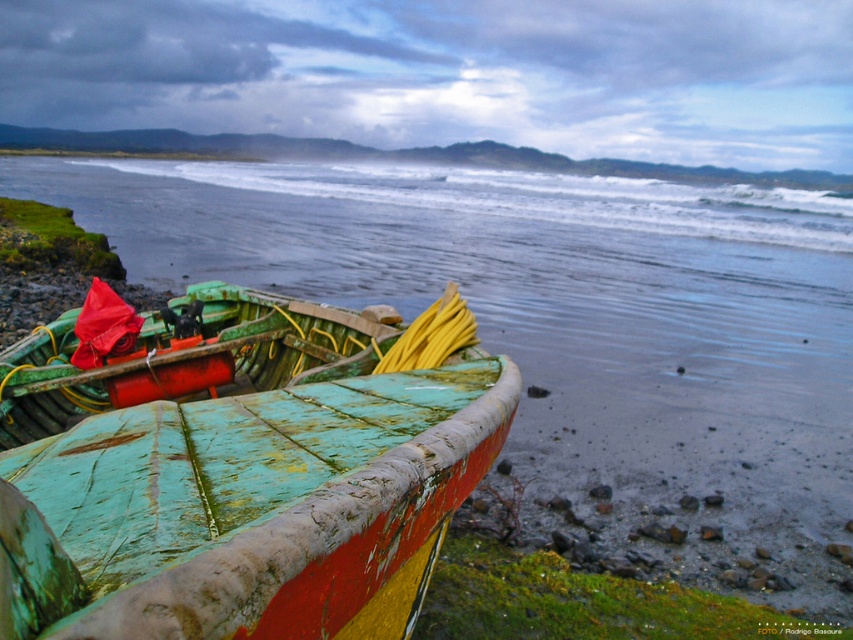
Can you confirm if greenish-blue water at lower left is shorter than green weathered wood boat at lower left?

Incorrect, greenish-blue water at lower left's height does not fall short of green weathered wood boat at lower left's.

Is point (813, 408) farther from camera compared to point (316, 307)?

Yes, it is.

The height and width of the screenshot is (640, 853). Identify the location of greenish-blue water at lower left. (561, 323).